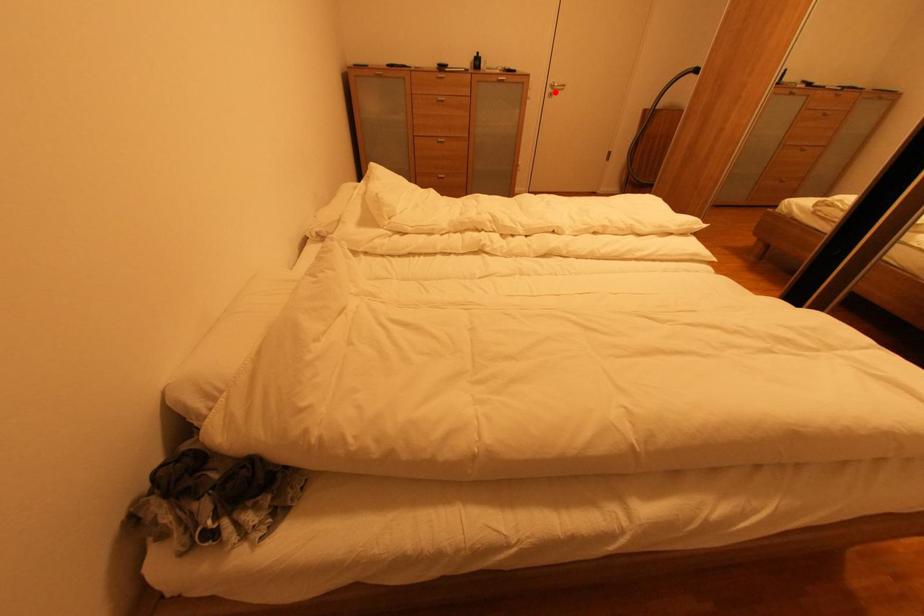
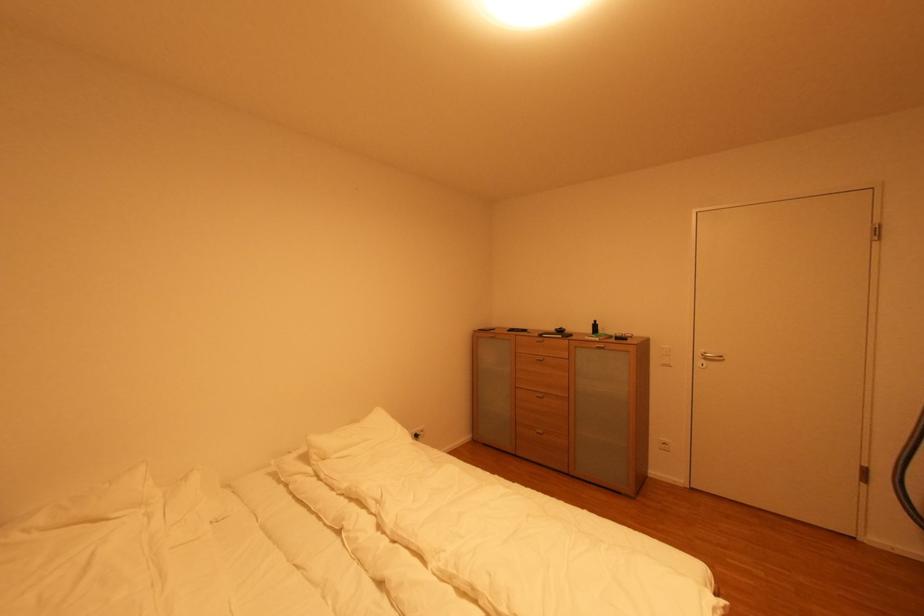
Where in the second image is the point corresponding to the highlighted location from the first image?

(706, 362)